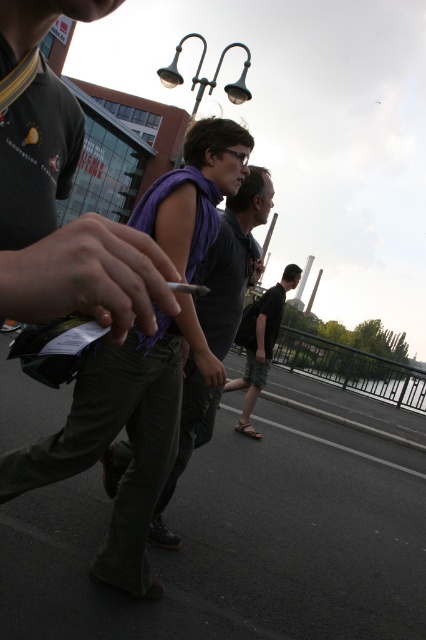
At what (x,y) coordinates should I click in order to perform the action: click on black cotton shorts at center. Please return your answer as a coordinate pair (x, y). The image size is (426, 640). Looking at the image, I should click on (259, 342).

Can you confirm if black cotton shorts at center is taller than black matte cigarette at center?

Yes, black cotton shorts at center is taller than black matte cigarette at center.

Who is more forward, [264,310] or [207,292]?

Point [207,292] is more forward.

Identify the location of black cotton shorts at center. (259, 342).

Does purple scarf at center lie in front of black cotton shorts at center?

Yes, it is.

This screenshot has height=640, width=426. What are the coordinates of `purple scarf at center` in the screenshot? It's located at (233, 260).

You are a GUI agent. You are given a task and a screenshot of the screen. Output one action in this format:
    pyautogui.click(x=<x>, y=<y>)
    Task: Click on the purple scarf at center
    The image size is (426, 640).
    Given the screenshot: What is the action you would take?
    pyautogui.click(x=233, y=260)

Does purple scarf at center have a larger size compared to black matte cigarette at center?

Correct, purple scarf at center is larger in size than black matte cigarette at center.

Who is more distant from viewer, (183, 433) or (181, 288)?

The point (183, 433) is more distant.

Identify the location of purple scarf at center. This screenshot has width=426, height=640. (233, 260).